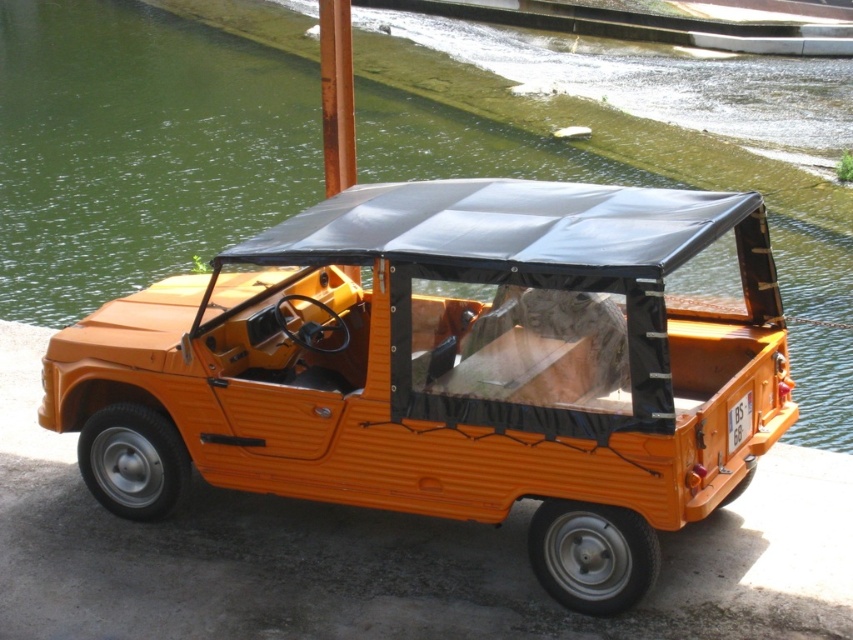
Is point (343, 218) closer to camera compared to point (190, 113)?

Yes, point (343, 218) is in front of point (190, 113).

Is point (341, 488) more distant than point (15, 164)?

That is False.

Identify the location of orange matte car at center. This screenshot has width=853, height=640. (448, 371).